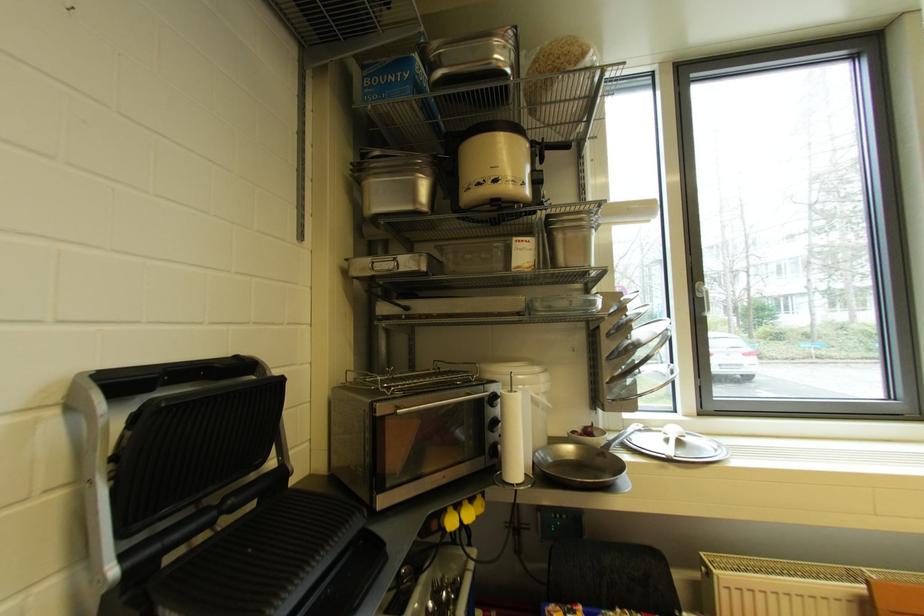
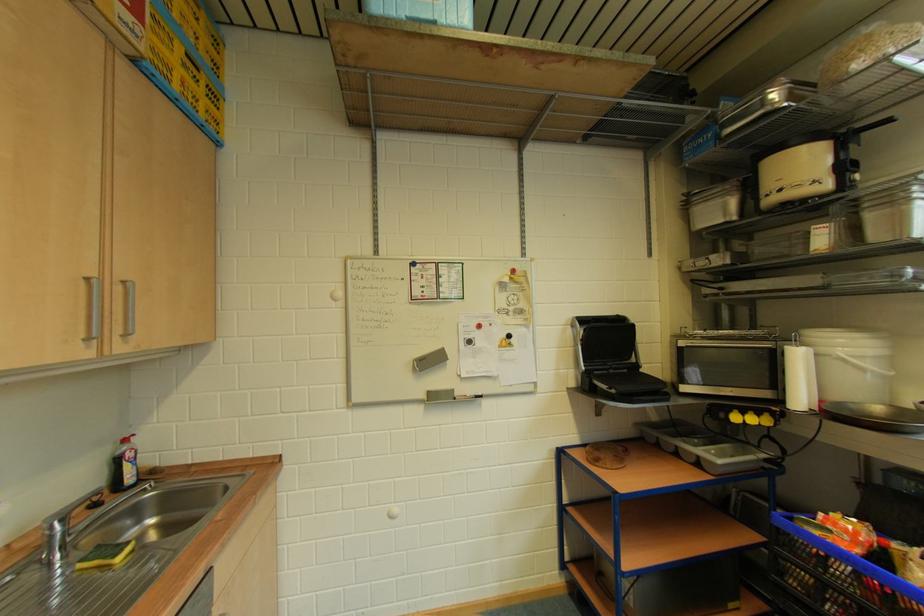
The point at (385, 416) is marked in the first image. Where is the corresponding point in the second image?

(687, 347)